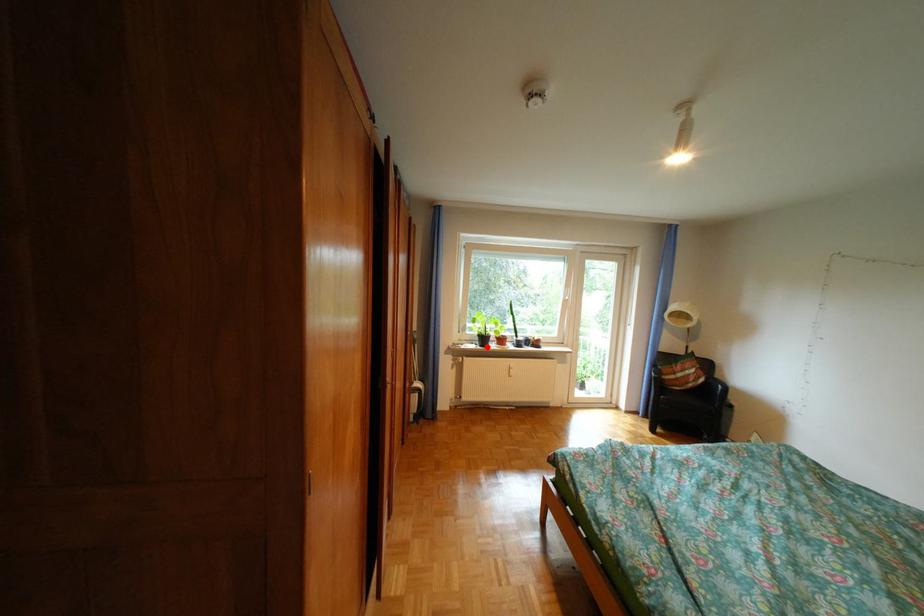
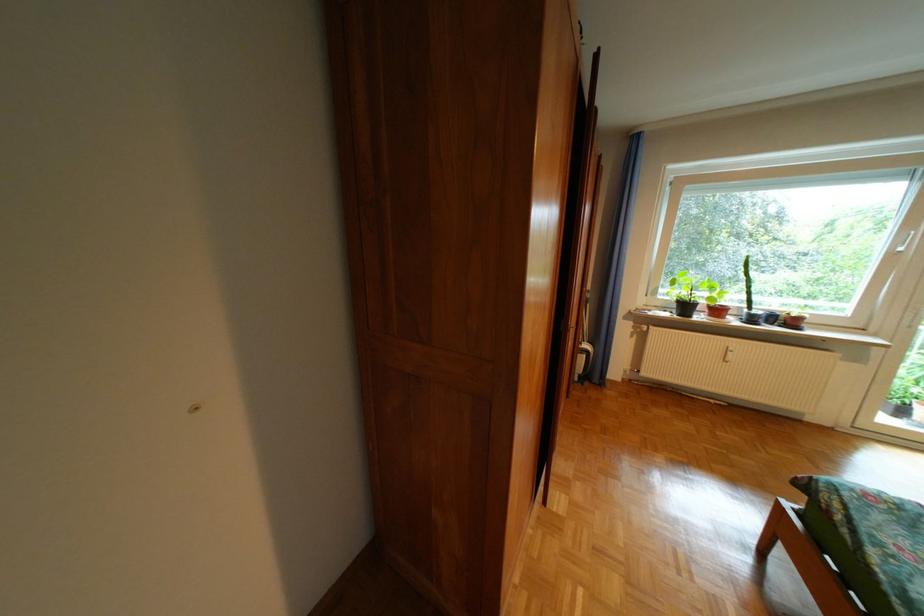
Find the pixel in the second image that matches the highlighted location in the first image.

(679, 315)